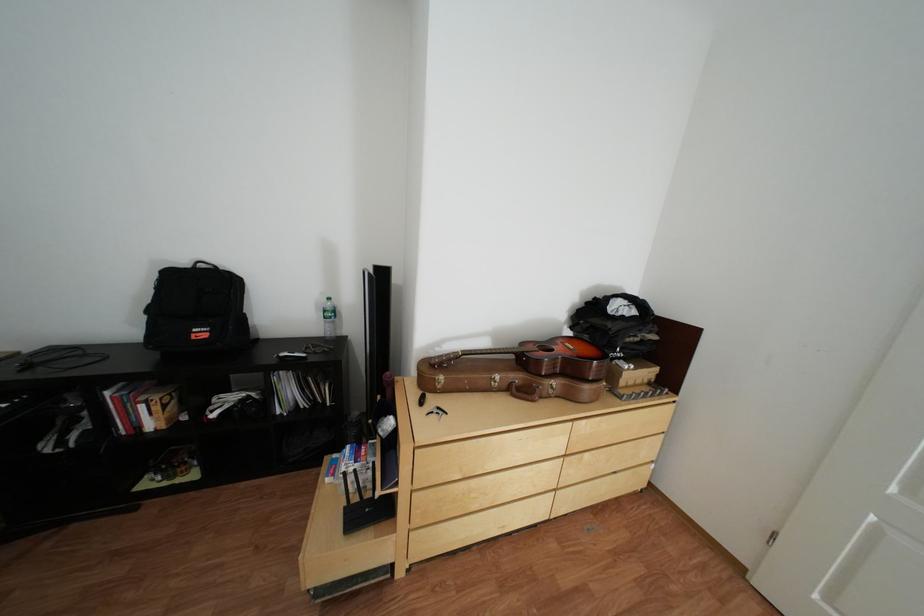
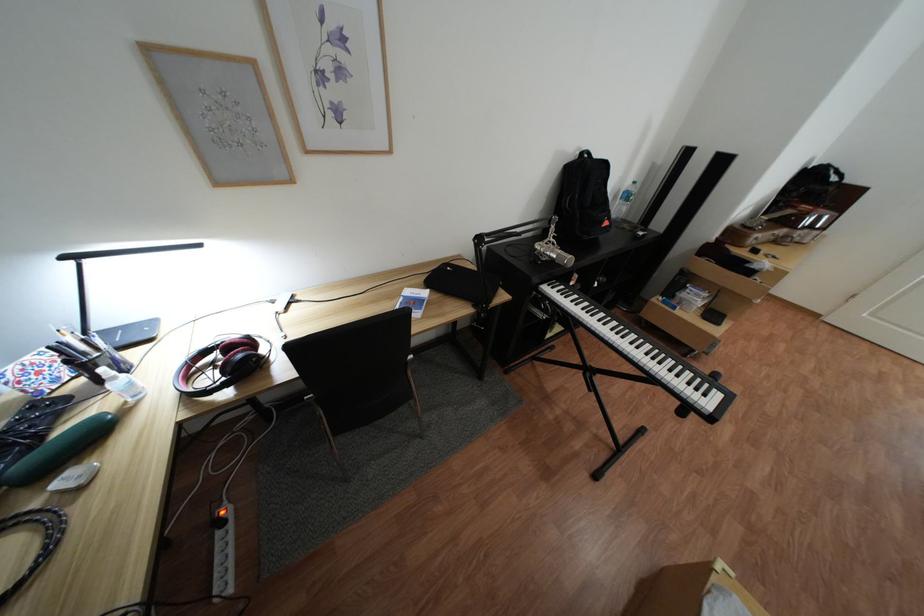
Question: What movement of the cameraman would produce the second image?

Choices:
 (A) Left
 (B) Right
 (C) Forward
 (D) Backward

Answer: (A)